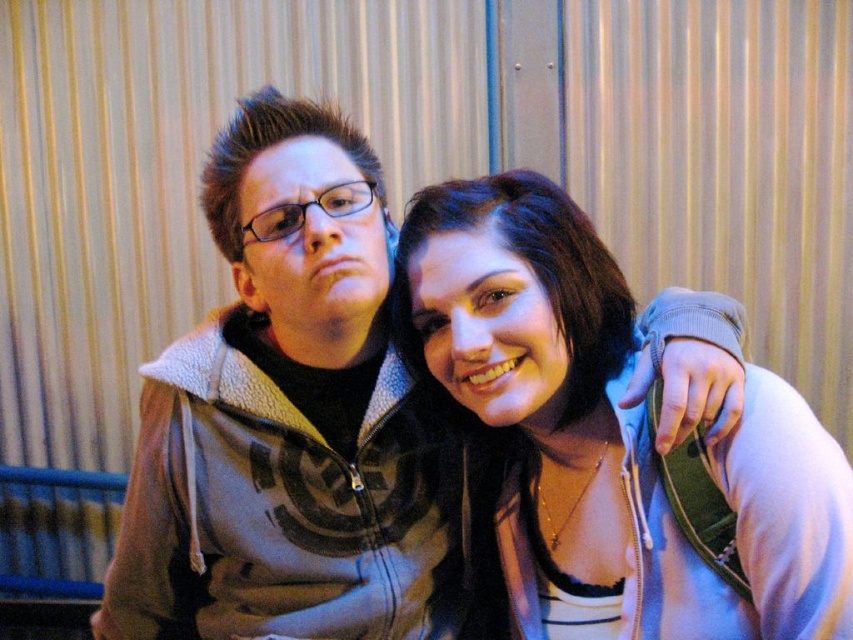
Question: Which point appears closest to the camera in this image?

Choices:
 (A) (x=770, y=520)
 (B) (x=252, y=577)

Answer: (A)

Question: Is gray fleece hoodie at center above matte gray hoodie at center?

Choices:
 (A) yes
 (B) no

Answer: (A)

Question: Among these objects, which one is farthest from the camera?

Choices:
 (A) gray fleece hoodie at center
 (B) matte gray hoodie at center

Answer: (A)

Question: Is gray fleece hoodie at center above matte gray hoodie at center?

Choices:
 (A) yes
 (B) no

Answer: (A)

Question: Can you confirm if gray fleece hoodie at center is positioned above matte gray hoodie at center?

Choices:
 (A) no
 (B) yes

Answer: (B)